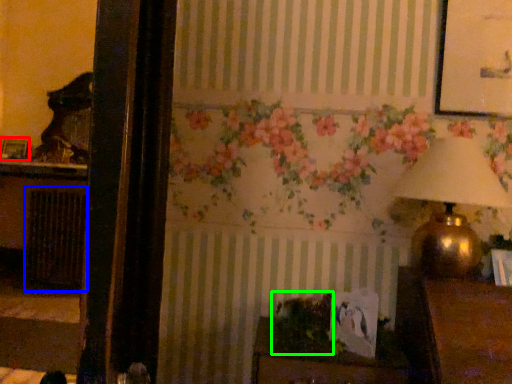
Question: Which object is the closest to the picture frame (highlighted by a red box)? Choose among these: radiator (highlighted by a blue box) or plant (highlighted by a green box).

Choices:
 (A) radiator
 (B) plant

Answer: (A)